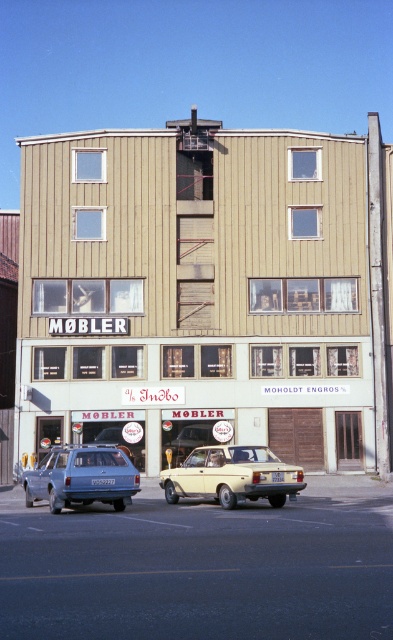
You are a delivery driver arriving at the MOBLER store. You see a yellow matte car at center and a matte blue station wagon at lower left. Which vehicle is parked closer to the entrance of the store?

The matte blue station wagon at lower left is closer to the entrance because the yellow matte car at center is located above it, meaning it is further away from the entrance.

You are a customer arriving at MOBLER furniture store and see the yellow matte car at center and the matte blue station wagon at lower left. Which vehicle is positioned to the right of the other?

The yellow matte car at center is positioned to the right of the matte blue station wagon at lower left.